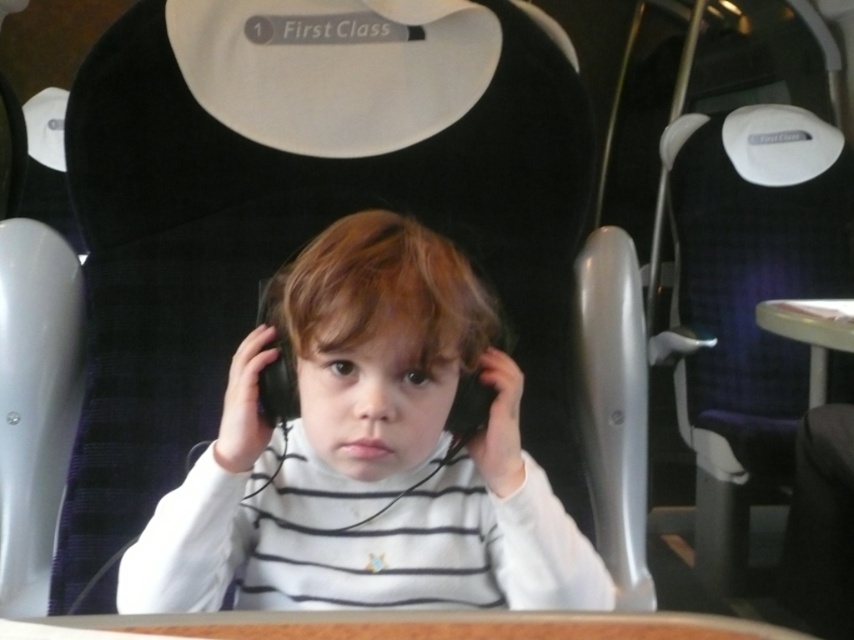
Question: Estimate the real-world distances between objects in this image. Which object is farther from the black matte headphones at center?

Choices:
 (A) purple fabric chair at center
 (B) white matte headphones at center
 (C) brown wood table at center

Answer: (A)

Question: Can you confirm if purple fabric chair at center is wider than brown wood table at center?

Choices:
 (A) yes
 (B) no

Answer: (B)

Question: Which of these objects is positioned closest to the purple fabric chair at center?

Choices:
 (A) brown wood table at center
 (B) black matte headphones at center

Answer: (B)

Question: Among these objects, which one is nearest to the camera?

Choices:
 (A) black matte headphones at center
 (B) white matte headphones at center

Answer: (B)

Question: Does purple fabric chair at center appear under black matte headphones at center?

Choices:
 (A) yes
 (B) no

Answer: (A)

Question: Is purple fabric chair at center to the right of brown wood table at center from the viewer's perspective?

Choices:
 (A) yes
 (B) no

Answer: (A)